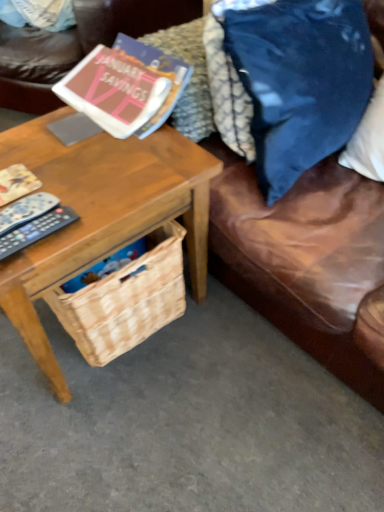
Locate an element on the screen. This screenshot has height=512, width=384. free spot in front of woodenobject at left is located at coordinates (129, 433).